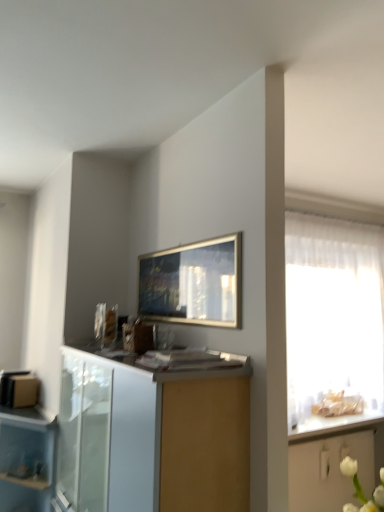
The width and height of the screenshot is (384, 512). In order to click on transparent plastic drawer at lower left in this screenshot , I will do click(27, 458).

The image size is (384, 512). Describe the element at coordinates (333, 316) in the screenshot. I see `translucent fabric at right` at that location.

Identify the location of white glossy countertop at right. The image size is (384, 512). (334, 425).

The image size is (384, 512). What do you see at coordinates (153, 433) in the screenshot?
I see `white glossy cabinet at lower center, acting as the 1th cabinetry starting from the top` at bounding box center [153, 433].

Locate an element on the screen. The height and width of the screenshot is (512, 384). white glossy cabinet at lower right, which ranks as the first cabinetry in right-to-left order is located at coordinates (332, 470).

From the image's perspective, relative to white glossy countertop at right, is white glossy cabinet at lower right, marked as the second cabinetry in a top-to-bottom arrangement, above or below?

From the image's perspective, white glossy cabinet at lower right, marked as the second cabinetry in a top-to-bottom arrangement, appears below white glossy countertop at right.

Between white glossy cabinet at lower right, the 1th cabinetry viewed from the back, and white glossy countertop at right, which one has smaller width?

Thinner between the two is white glossy cabinet at lower right, the 1th cabinetry viewed from the back.

Is the depth of translucent fabric at right greater than that of transparent plastic drawer at lower left?

Yes, translucent fabric at right is further from the camera.

Does translucent fabric at right appear on the right side of transparent plastic drawer at lower left?

Correct, you'll find translucent fabric at right to the right of transparent plastic drawer at lower left.

From the image's perspective, is translucent fabric at right under transparent plastic drawer at lower left?

No.

Considering the sizes of objects white glossy cabinet at lower center, the second cabinetry from the back, and white glossy countertop at right in the image provided, who is wider, white glossy cabinet at lower center, the second cabinetry from the back, or white glossy countertop at right?

white glossy countertop at right.

Can we say white glossy cabinet at lower center, the second cabinetry from the bottom, lies outside white glossy countertop at right?

Yes, white glossy cabinet at lower center, the second cabinetry from the bottom, is not within white glossy countertop at right.

Which object is further away from the camera, white glossy cabinet at lower center, the 1th cabinetry in the left-to-right sequence, or white glossy countertop at right?

white glossy countertop at right is further away from the camera.

Find the location of `countertop that appears below the white glossy cabinet at lower center, the 1th cabinetry in the left-to-right sequence (from the image's perspective)`. countertop that appears below the white glossy cabinet at lower center, the 1th cabinetry in the left-to-right sequence (from the image's perspective) is located at coordinates (334, 425).

Where is `cupboard that appears on the left of white glossy cabinet at lower center, which appears as the 1th cabinetry when viewed from the front`? This screenshot has height=512, width=384. cupboard that appears on the left of white glossy cabinet at lower center, which appears as the 1th cabinetry when viewed from the front is located at coordinates (27, 458).

Does white glossy cabinet at lower center, the second cabinetry from the bottom, appear on the right side of transparent plastic drawer at lower left?

Correct, you'll find white glossy cabinet at lower center, the second cabinetry from the bottom, to the right of transparent plastic drawer at lower left.

Based on the photo, considering the relative sizes of white glossy cabinet at lower center, the 1th cabinetry in the left-to-right sequence, and transparent plastic drawer at lower left in the image provided, is white glossy cabinet at lower center, the 1th cabinetry in the left-to-right sequence, wider than transparent plastic drawer at lower left?

Correct, the width of white glossy cabinet at lower center, the 1th cabinetry in the left-to-right sequence, exceeds that of transparent plastic drawer at lower left.

Is white glossy countertop at right taller than transparent plastic drawer at lower left?

In fact, white glossy countertop at right may be shorter than transparent plastic drawer at lower left.

From a real-world perspective, is white glossy countertop at right positioned above or below transparent plastic drawer at lower left?

Clearly, from a real-world perspective, white glossy countertop at right is above transparent plastic drawer at lower left.

Which is farther, (331, 426) or (48, 453)?

Point (331, 426)

Is white glossy countertop at right closer to camera compared to transparent plastic drawer at lower left?

No.

Is white glossy cabinet at lower right, the second cabinetry when ordered from front to back, spatially inside transparent plastic drawer at lower left, or outside of it?

The correct answer is: outside.

Could you tell me if white glossy cabinet at lower right, the 1th cabinetry in the bottom-to-top sequence, is facing transparent plastic drawer at lower left?

No, white glossy cabinet at lower right, the 1th cabinetry in the bottom-to-top sequence, is not turned towards transparent plastic drawer at lower left.

How distant is white glossy cabinet at lower right, marked as the second cabinetry in a top-to-bottom arrangement, from transparent plastic drawer at lower left?

They are 6.22 feet apart.

Considering the sizes of objects white glossy cabinet at lower right, which appears as the second cabinetry when viewed from the left, and transparent plastic drawer at lower left in the image provided, who is smaller, white glossy cabinet at lower right, which appears as the second cabinetry when viewed from the left, or transparent plastic drawer at lower left?

With smaller size is white glossy cabinet at lower right, which appears as the second cabinetry when viewed from the left.

From the image's perspective, which one is positioned higher, white glossy countertop at right or white glossy cabinet at lower right, which appears as the second cabinetry when viewed from the left?

white glossy countertop at right is shown above in the image.

From the picture: Considering the sizes of objects white glossy countertop at right and white glossy cabinet at lower right, which appears as the second cabinetry when viewed from the left, in the image provided, who is smaller, white glossy countertop at right or white glossy cabinet at lower right, which appears as the second cabinetry when viewed from the left,?

Smaller between the two is white glossy countertop at right.

Is white glossy countertop at right facing away from white glossy cabinet at lower right, the second cabinetry when ordered from front to back?

No.

Which of these two, white glossy countertop at right or white glossy cabinet at lower right, marked as the second cabinetry in a top-to-bottom arrangement, is wider?

white glossy countertop at right is wider.

In the image, there is a white glossy countertop at right. Identify the location of cabinetry below it (from a real-world perspective). [332, 470].

Locate an element on the screen. Image resolution: width=384 pixels, height=512 pixels. window behind the transparent plastic drawer at lower left is located at coordinates (333, 316).

Considering their positions, is white glossy cabinet at lower center, acting as the 1th cabinetry starting from the top, positioned further to white glossy countertop at right than transparent plastic drawer at lower left?

Among the two, white glossy cabinet at lower center, acting as the 1th cabinetry starting from the top, is located further to white glossy countertop at right.

Consider the image. When comparing their distances from white glossy cabinet at lower right, marked as the second cabinetry in a top-to-bottom arrangement, does transparent plastic drawer at lower left or white glossy countertop at right seem closer?

The object closer to white glossy cabinet at lower right, marked as the second cabinetry in a top-to-bottom arrangement, is white glossy countertop at right.

Based on their spatial positions, is white glossy cabinet at lower right, marked as the second cabinetry in a top-to-bottom arrangement, or white glossy cabinet at lower center, the second cabinetry from the back, further from transparent plastic drawer at lower left?

The object further to transparent plastic drawer at lower left is white glossy cabinet at lower right, marked as the second cabinetry in a top-to-bottom arrangement.

Which object lies nearer to the anchor point white glossy countertop at right, white glossy cabinet at lower right, the 1th cabinetry in the bottom-to-top sequence, or translucent fabric at right?

Among the two, white glossy cabinet at lower right, the 1th cabinetry in the bottom-to-top sequence, is located nearer to white glossy countertop at right.

From the image, which object appears to be nearer to transparent plastic drawer at lower left, white glossy countertop at right or white glossy cabinet at lower right, the 1th cabinetry in the bottom-to-top sequence?

The object closer to transparent plastic drawer at lower left is white glossy countertop at right.

Looking at the image, which one is located closer to white glossy cabinet at lower center, acting as the 1th cabinetry starting from the top, transparent plastic drawer at lower left or white glossy countertop at right?

Among the two, transparent plastic drawer at lower left is located nearer to white glossy cabinet at lower center, acting as the 1th cabinetry starting from the top.

From the image, which object appears to be nearer to white glossy cabinet at lower center, the 2th cabinetry in the right-to-left sequence, translucent fabric at right or white glossy cabinet at lower right, which ranks as the first cabinetry in right-to-left order?

The object closer to white glossy cabinet at lower center, the 2th cabinetry in the right-to-left sequence, is white glossy cabinet at lower right, which ranks as the first cabinetry in right-to-left order.

Looking at the image, which one is located closer to white glossy cabinet at lower right, which appears as the second cabinetry when viewed from the left, transparent plastic drawer at lower left or translucent fabric at right?

translucent fabric at right.

The width and height of the screenshot is (384, 512). In order to click on countertop located between white glossy cabinet at lower center, acting as the 1th cabinetry starting from the top, and white glossy cabinet at lower right, the 1th cabinetry viewed from the back, in the depth direction in this screenshot , I will do (334, 425).

Find the location of a particular element. countertop between transparent plastic drawer at lower left and translucent fabric at right from left to right is located at coordinates (334, 425).

At what (x,y) coordinates should I click in order to perform the action: click on window between white glossy cabinet at lower center, which appears as the 1th cabinetry when viewed from the front, and white glossy countertop at right from front to back. Please return your answer as a coordinate pair (x, y). This screenshot has height=512, width=384. Looking at the image, I should click on (333, 316).

Image resolution: width=384 pixels, height=512 pixels. I want to click on countertop situated between transparent plastic drawer at lower left and white glossy cabinet at lower right, the 1th cabinetry viewed from the back, from left to right, so click(334, 425).